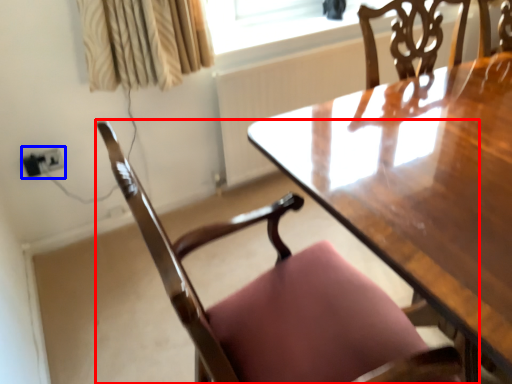
Question: Which of the following is the farthest to the observer, chair (highlighted by a red box) or electric outlet (highlighted by a blue box)?

Choices:
 (A) chair
 (B) electric outlet

Answer: (B)